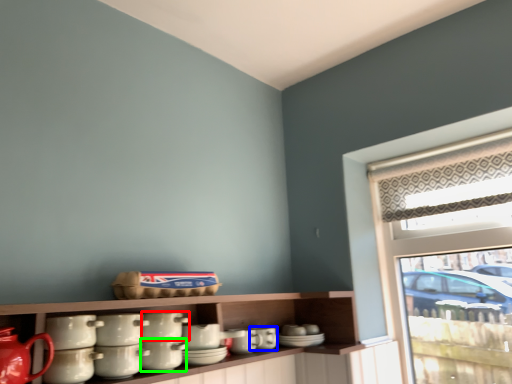
Question: Based on their relative distances, which object is nearer to tableware (highlighted by a red box)? Choose from tableware (highlighted by a blue box) and tableware (highlighted by a green box).

Choices:
 (A) tableware
 (B) tableware

Answer: (B)